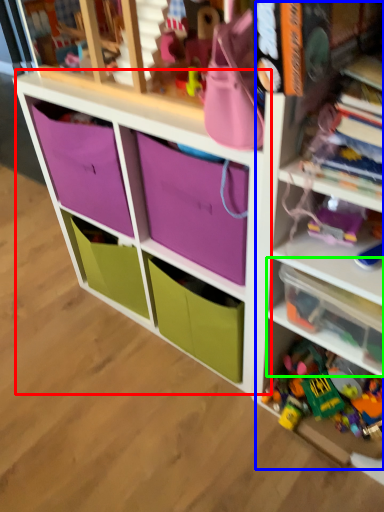
Question: Estimate the real-world distances between objects in this image. Which object is closer to cabinet (highlighted by a red box), bookshelf (highlighted by a blue box) or shelf (highlighted by a green box)?

Choices:
 (A) bookshelf
 (B) shelf

Answer: (A)